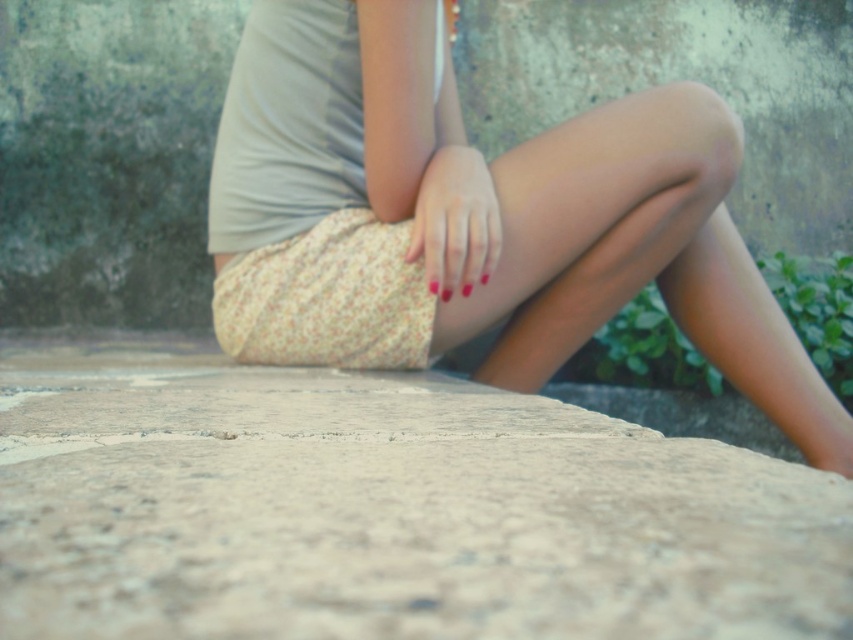
Question: From the image, what is the correct spatial relationship of floral fabric skirt at center in relation to smooth matte hand at center?

Choices:
 (A) left
 (B) right

Answer: (B)

Question: Which point is closer to the camera taking this photo?

Choices:
 (A) (76, 388)
 (B) (679, 276)
 (C) (465, 163)

Answer: (A)

Question: Is floral fabric skirt at center thinner than smooth matte hand at center?

Choices:
 (A) no
 (B) yes

Answer: (A)

Question: Which object appears closest to the camera in this image?

Choices:
 (A) floral fabric skirt at center
 (B) smooth matte hand at center
 (C) smooth stone surface at center

Answer: (C)

Question: Among these objects, which one is nearest to the camera?

Choices:
 (A) smooth stone surface at center
 (B) floral fabric skirt at center

Answer: (A)

Question: Can you confirm if floral fabric skirt at center is smaller than smooth matte hand at center?

Choices:
 (A) no
 (B) yes

Answer: (A)